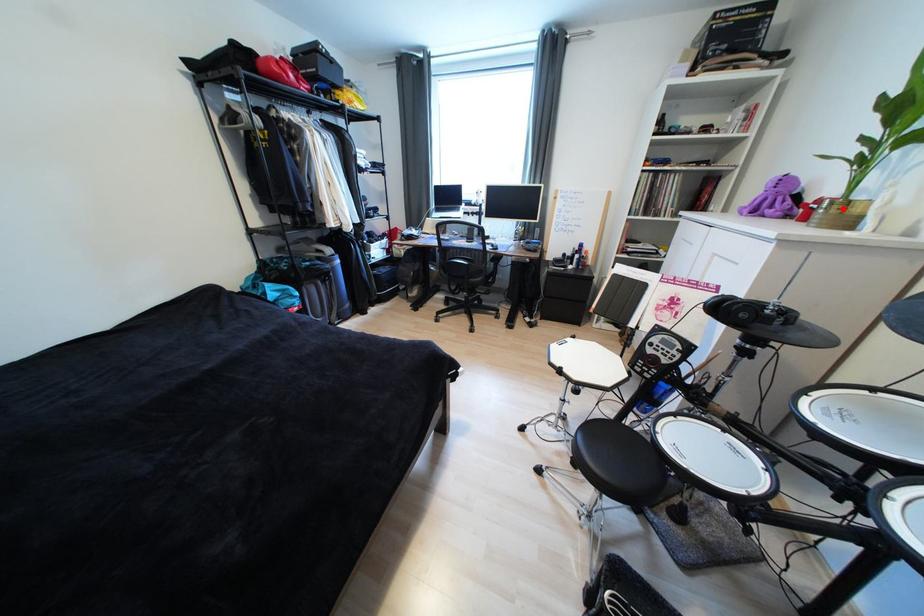
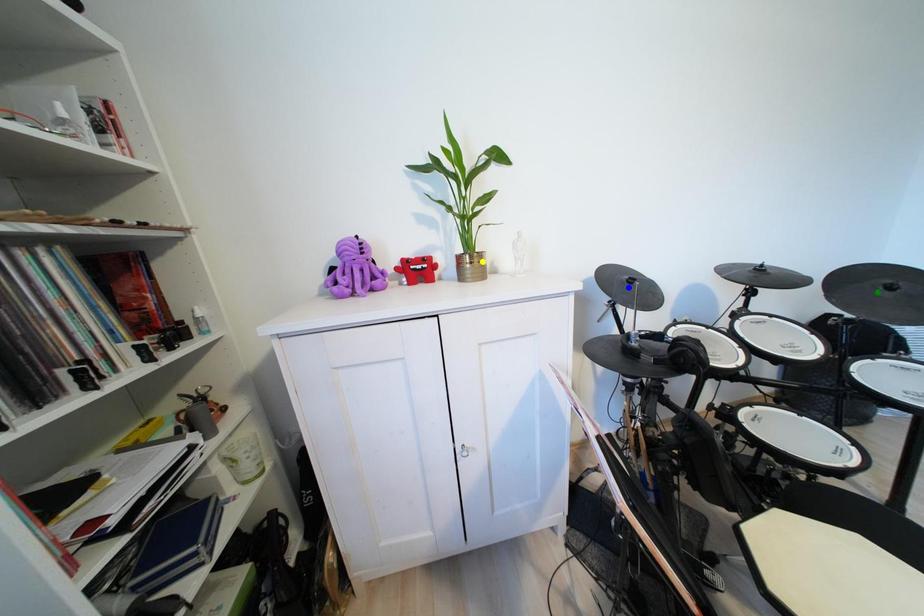
Question: I am providing you with two images of the same scene from different viewpoints. A red point is marked on the first image. You are given multiple points on the second image. Which point in image 2 represents the same 3d spot as the red point in image 1?

Choices:
 (A) green point
 (B) yellow point
 (C) blue point

Answer: (B)